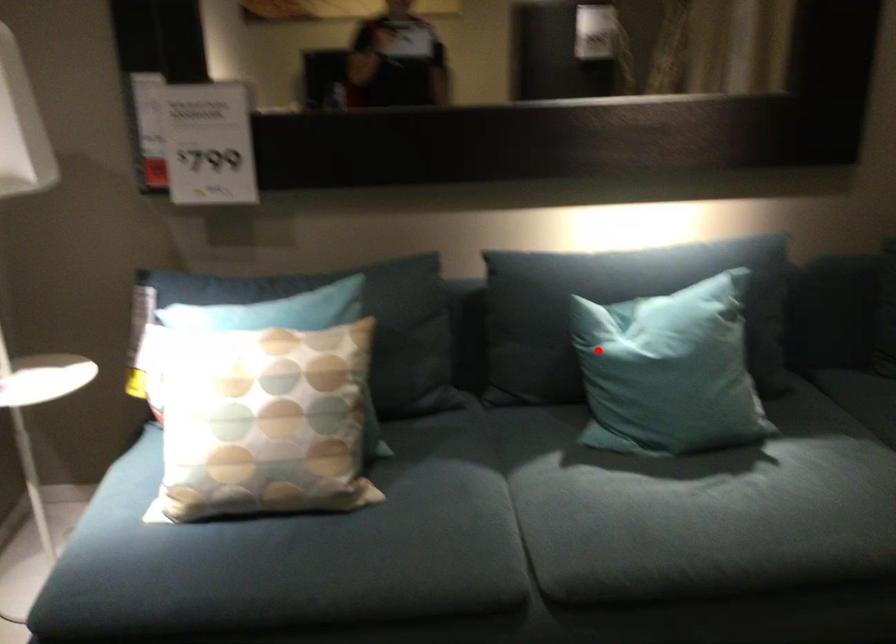
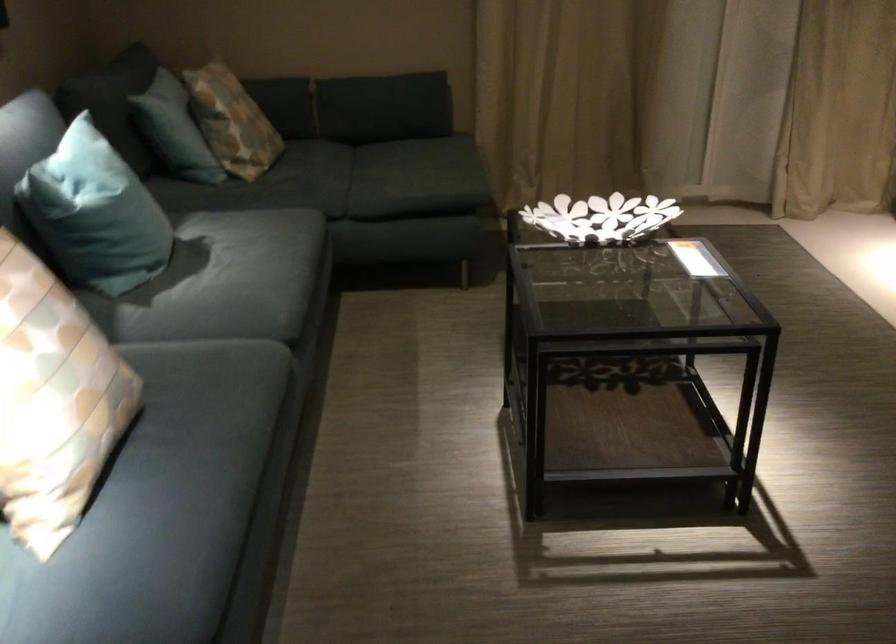
The point at the highlighted location is marked in the first image. Where is the corresponding point in the second image?

(95, 214)